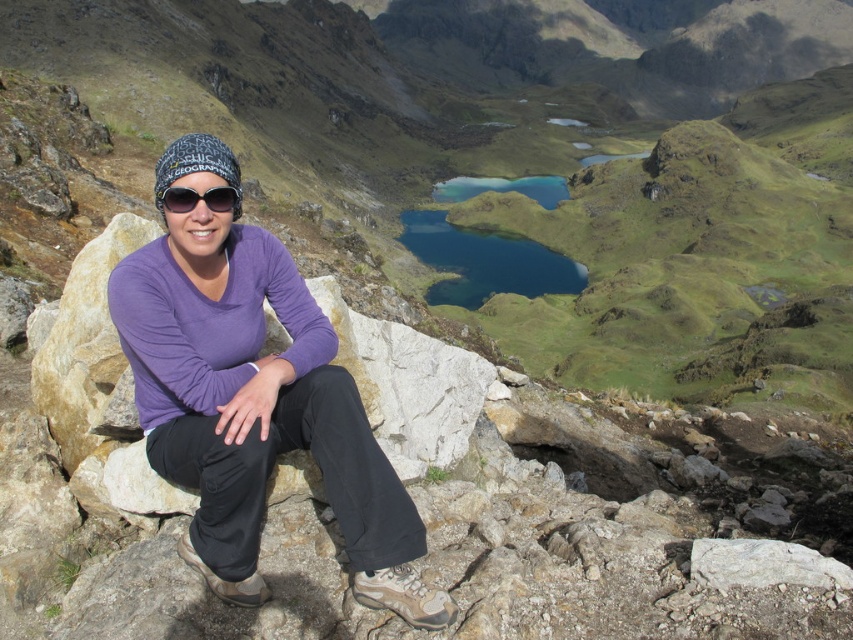
You are a photographer trying to capture the hiker in the scene. You notice the purple cotton shirt at center and sunglasses at center. Which object should you focus on first if you want to ensure both are in the frame without moving the camera?

You should focus on the sunglasses at center first because the purple cotton shirt at center is to the right of the sunglasses at center. By centering the sunglasses and adjusting the frame to include the shirt to its right, both objects will be captured without moving the camera.